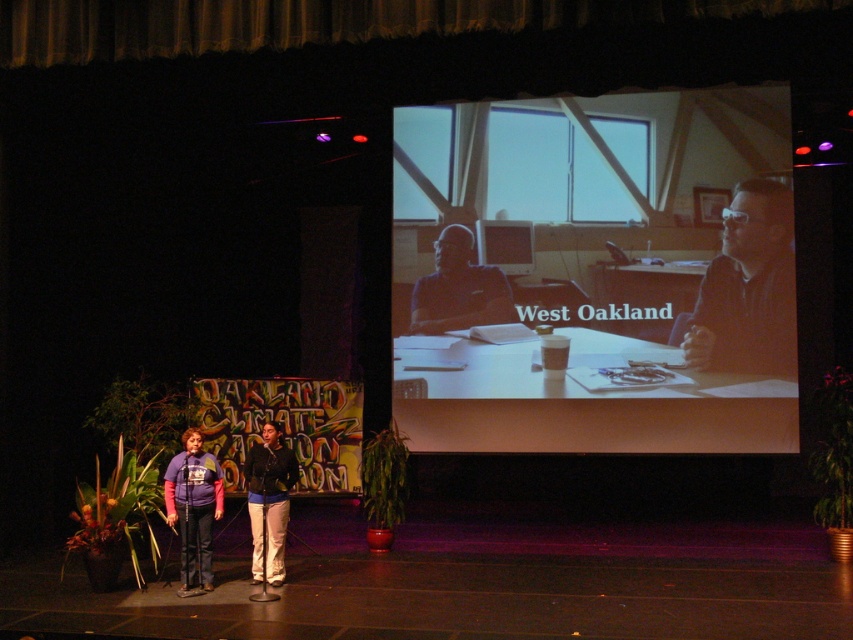
Question: Is velvet gold curtain at upper center positioned at the back of purple fleece jacket at center?

Choices:
 (A) yes
 (B) no

Answer: (B)

Question: Observing the image, what is the correct spatial positioning of matte white board at upper center in reference to dark blue sweater at center?

Choices:
 (A) above
 (B) below

Answer: (A)

Question: Which of the following is the farthest from the observer?

Choices:
 (A) (196, 433)
 (B) (485, 266)

Answer: (B)

Question: Which point appears farthest from the camera in this image?

Choices:
 (A) (67, 35)
 (B) (187, 433)

Answer: (A)

Question: Which object is closer to the camera taking this photo?

Choices:
 (A) matte white board at upper center
 (B) matte black glasses at upper right
 (C) purple fleece jacket at center

Answer: (C)

Question: Is velvet gold curtain at upper center bigger than matte black glasses at upper right?

Choices:
 (A) yes
 (B) no

Answer: (A)